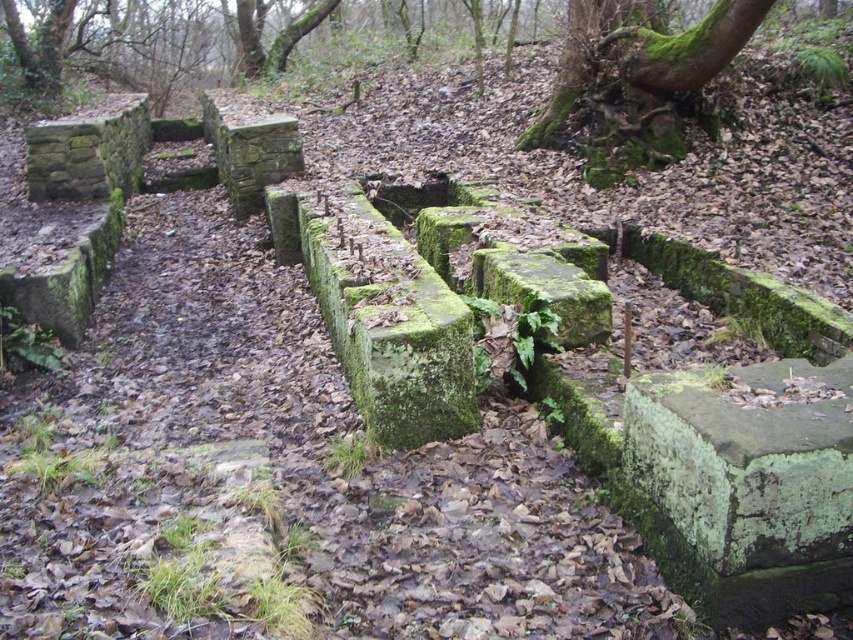
Can you confirm if green mossy stone at lower right is positioned above green mossy stone at center?

Incorrect, green mossy stone at lower right is not positioned above green mossy stone at center.

Is point (764, 525) closer to viewer compared to point (583, 260)?

Yes, it is in front of point (583, 260).

Who is more distant from viewer, (645,432) or (579,333)?

The point (579,333) is more distant.

What are the coordinates of `green mossy stone at lower right` in the screenshot? It's located at (746, 460).

Is green mossy stone at lower right behind green mossy tree trunk at upper right?

No, green mossy stone at lower right is closer to the viewer.

Does green mossy stone at lower right lie in front of green mossy tree trunk at upper right?

Yes.

Between point (664, 401) and point (596, 157), which one is positioned in front?

Positioned in front is point (664, 401).

I want to click on green mossy stone at lower right, so click(x=746, y=460).

Looking at this image, who is positioned more to the right, green mossy stone at upper left or green mossy stone at center?

green mossy stone at center is more to the right.

Between point (36, 168) and point (561, 304), which one is positioned behind?

The point (36, 168) is behind.

At what (x,y) coordinates should I click in order to perform the action: click on green mossy stone at upper left. Please return your answer as a coordinate pair (x, y). The width and height of the screenshot is (853, 640). Looking at the image, I should click on (88, 150).